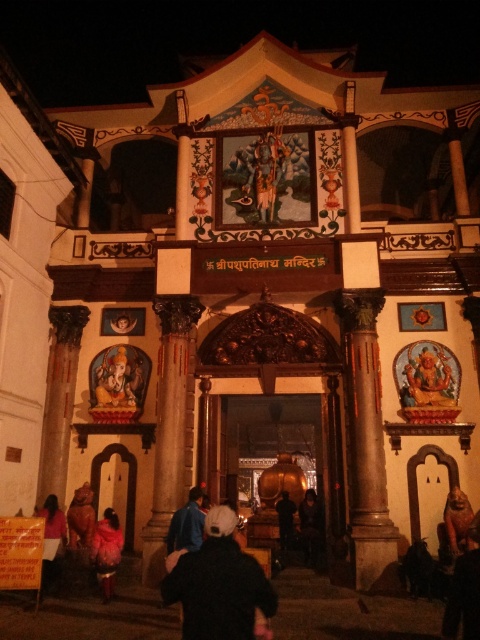
Is black fabric at center bigger than matte golden statue at lower left?

Correct, black fabric at center is larger in size than matte golden statue at lower left.

Can you confirm if black fabric at center is positioned below matte golden statue at lower left?

Indeed, black fabric at center is positioned under matte golden statue at lower left.

Image resolution: width=480 pixels, height=640 pixels. In order to click on black fabric at center in this screenshot , I will do `click(219, 586)`.

Identify the location of black fabric at center. (219, 586).

Consider the image. Is golden statue at center thinner than matte pink dress at lower left?

Incorrect, golden statue at center's width is not less than matte pink dress at lower left's.

Does point (268, 211) come in front of point (47, 556)?

That is False.

Where is `golden statue at center`? The width and height of the screenshot is (480, 640). golden statue at center is located at coordinates (266, 172).

Is matte golden statue at lower left closer to the viewer compared to matte pink dress at lower left?

No, it is not.

The image size is (480, 640). Identify the location of matte golden statue at lower left. (118, 378).

Who is more distant from viewer, (137, 406) or (49, 524)?

The point (137, 406) is more distant.

The height and width of the screenshot is (640, 480). Find the location of `matte golden statue at lower left`. matte golden statue at lower left is located at coordinates (118, 378).